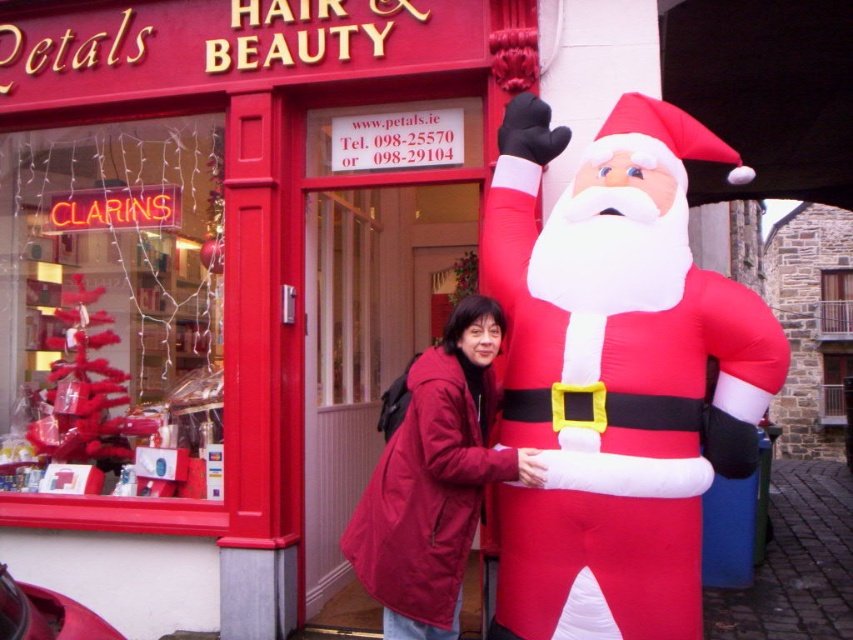
Question: Which object appears closest to the camera in this image?

Choices:
 (A) matte red store at center
 (B) matte red coat at center
 (C) inflatable red santa claus at right

Answer: (C)

Question: Which object is farther from the camera taking this photo?

Choices:
 (A) inflatable red santa claus at right
 (B) matte red coat at center

Answer: (B)

Question: Which point is closer to the camera?

Choices:
 (A) (141, 60)
 (B) (393, 410)

Answer: (B)

Question: Does matte red store at center have a greater width compared to matte red coat at center?

Choices:
 (A) no
 (B) yes

Answer: (B)

Question: Is matte red store at center positioned in front of inflatable red santa claus at right?

Choices:
 (A) yes
 (B) no

Answer: (B)

Question: Is matte red store at center to the left of inflatable red santa claus at right from the viewer's perspective?

Choices:
 (A) no
 (B) yes

Answer: (B)